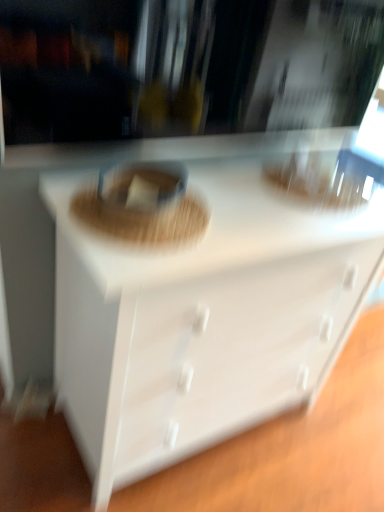
Question: Should I look upward or downward to see white glossy chest of drawers at center?

Choices:
 (A) up
 (B) down

Answer: (B)

Question: Can you confirm if white glossy chest of drawers at center is taller than brown woven basket at center?

Choices:
 (A) yes
 (B) no

Answer: (A)

Question: From a real-world perspective, is white glossy chest of drawers at center over brown woven basket at center?

Choices:
 (A) yes
 (B) no

Answer: (B)

Question: From the image's perspective, is white glossy chest of drawers at center under brown woven basket at center?

Choices:
 (A) no
 (B) yes

Answer: (B)

Question: From the image's perspective, would you say white glossy chest of drawers at center is positioned over brown woven basket at center?

Choices:
 (A) no
 (B) yes

Answer: (A)

Question: Is white glossy chest of drawers at center positioned far away from brown woven basket at center?

Choices:
 (A) no
 (B) yes

Answer: (A)

Question: Considering the relative positions of white glossy chest of drawers at center and brown woven basket at center in the image provided, is white glossy chest of drawers at center to the right of brown woven basket at center from the viewer's perspective?

Choices:
 (A) no
 (B) yes

Answer: (B)

Question: Can you confirm if brown woven basket at center is positioned to the right of white glossy chest of drawers at center?

Choices:
 (A) yes
 (B) no

Answer: (B)

Question: Does brown woven basket at center have a greater height compared to white glossy chest of drawers at center?

Choices:
 (A) no
 (B) yes

Answer: (A)

Question: Is brown woven basket at center positioned with its back to white glossy chest of drawers at center?

Choices:
 (A) yes
 (B) no

Answer: (B)

Question: Considering the relative sizes of brown woven basket at center and white glossy chest of drawers at center in the image provided, is brown woven basket at center thinner than white glossy chest of drawers at center?

Choices:
 (A) no
 (B) yes

Answer: (B)

Question: Does brown woven basket at center have a greater width compared to white glossy chest of drawers at center?

Choices:
 (A) no
 (B) yes

Answer: (A)

Question: Is brown woven basket at center behind white glossy chest of drawers at center?

Choices:
 (A) no
 (B) yes

Answer: (B)

Question: Which is correct: white glossy chest of drawers at center is inside brown woven basket at center, or outside of it?

Choices:
 (A) outside
 (B) inside

Answer: (A)